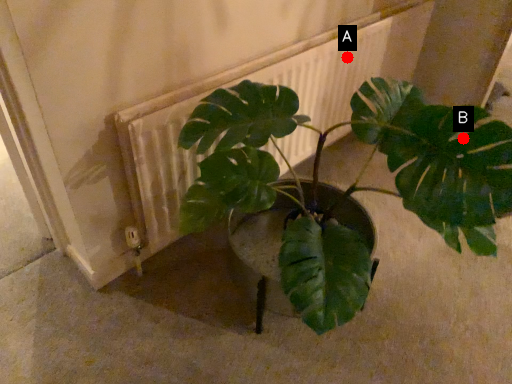
Question: Two points are circled on the image, labeled by A and B beside each circle. Which point is farther from the camera taking this photo?

Choices:
 (A) A is further
 (B) B is further

Answer: (A)